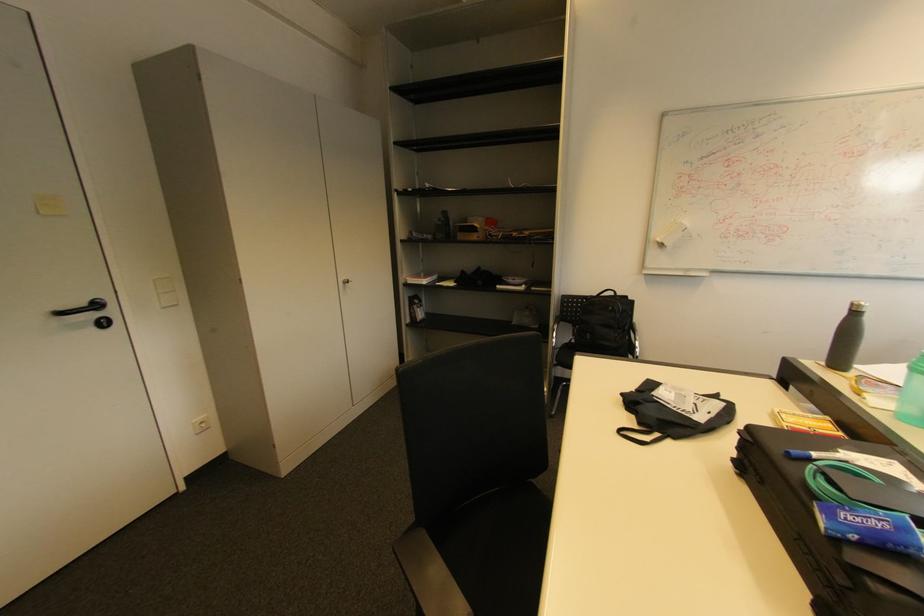
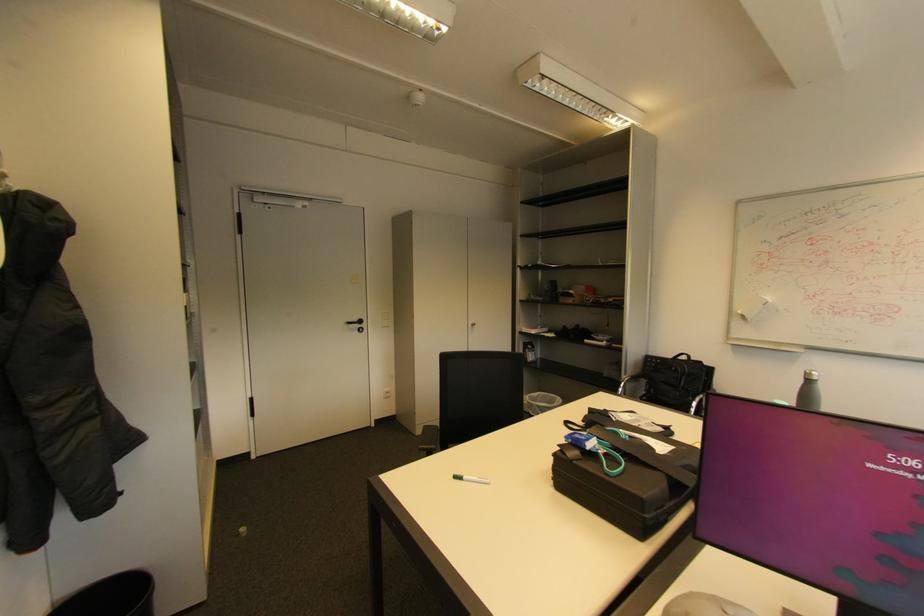
The point at (351, 283) is marked in the first image. Where is the corresponding point in the second image?

(479, 326)